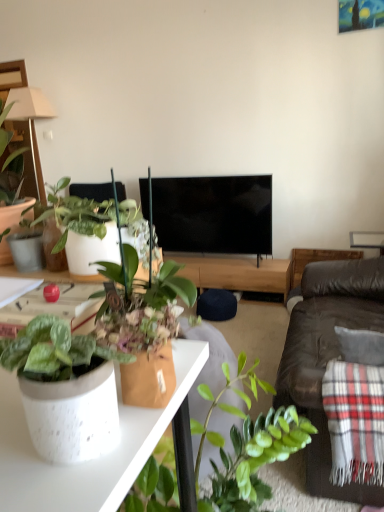
Question: From a real-world perspective, does black glossy tv at center stand above white speckled pot at left, the second houseplant positioned from the bottom?

Choices:
 (A) no
 (B) yes

Answer: (A)

Question: Considering the relative sizes of black glossy tv at center and white speckled pot at left, acting as the first houseplant starting from the top, in the image provided, is black glossy tv at center thinner than white speckled pot at left, acting as the first houseplant starting from the top,?

Choices:
 (A) yes
 (B) no

Answer: (B)

Question: Is black glossy tv at center not near white speckled pot at left, acting as the first houseplant starting from the top?

Choices:
 (A) no
 (B) yes

Answer: (B)

Question: Is black glossy tv at center positioned before white speckled pot at left, the second houseplant positioned from the bottom?

Choices:
 (A) yes
 (B) no

Answer: (B)

Question: From the image's perspective, does black glossy tv at center appear higher than white speckled pot at left, which is counted as the second houseplant, starting from the right?

Choices:
 (A) yes
 (B) no

Answer: (A)

Question: Would you say white speckled pot at left, acting as the first houseplant starting from the top, is inside or outside white speckled ceramic pot at lower left?

Choices:
 (A) outside
 (B) inside

Answer: (A)

Question: Considering the positions of white speckled pot at left, which is counted as the second houseplant, starting from the right, and white speckled ceramic pot at lower left in the image, is white speckled pot at left, which is counted as the second houseplant, starting from the right, wider or thinner than white speckled ceramic pot at lower left?

Choices:
 (A) thin
 (B) wide

Answer: (B)

Question: From a real-world perspective, is white speckled pot at left, the second houseplant positioned from the bottom, positioned above or below white speckled ceramic pot at lower left?

Choices:
 (A) above
 (B) below

Answer: (A)

Question: Considering the positions of white speckled pot at left, which is counted as the second houseplant, starting from the right, and white speckled ceramic pot at lower left in the image, is white speckled pot at left, which is counted as the second houseplant, starting from the right, taller or shorter than white speckled ceramic pot at lower left?

Choices:
 (A) short
 (B) tall

Answer: (B)

Question: From the image's perspective, is white speckled ceramic pot at lower left positioned above or below white speckled pot at left, acting as the first houseplant starting from the top?

Choices:
 (A) above
 (B) below

Answer: (B)

Question: Is white speckled ceramic pot at lower left spatially inside white speckled pot at left, the second houseplant positioned from the bottom, or outside of it?

Choices:
 (A) outside
 (B) inside

Answer: (A)

Question: Considering the positions of point (125, 411) and point (122, 214), is point (125, 411) closer or farther from the camera than point (122, 214)?

Choices:
 (A) closer
 (B) farther

Answer: (A)

Question: Based on their positions, is white speckled ceramic pot at lower left located to the left or right of white speckled pot at left, acting as the first houseplant starting from the top?

Choices:
 (A) right
 (B) left

Answer: (A)

Question: Is beige fabric lamp at upper left taller or shorter than speckled ceramic pot at lower left, which is the first houseplant in front-to-back order?

Choices:
 (A) short
 (B) tall

Answer: (B)

Question: In the image, is beige fabric lamp at upper left on the left side or the right side of speckled ceramic pot at lower left, which is the first houseplant in front-to-back order?

Choices:
 (A) right
 (B) left

Answer: (B)